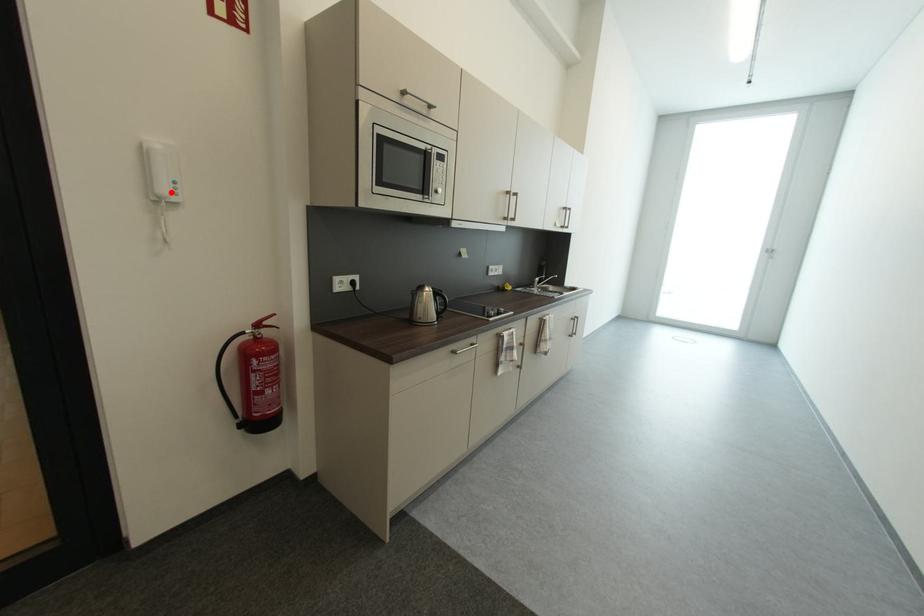
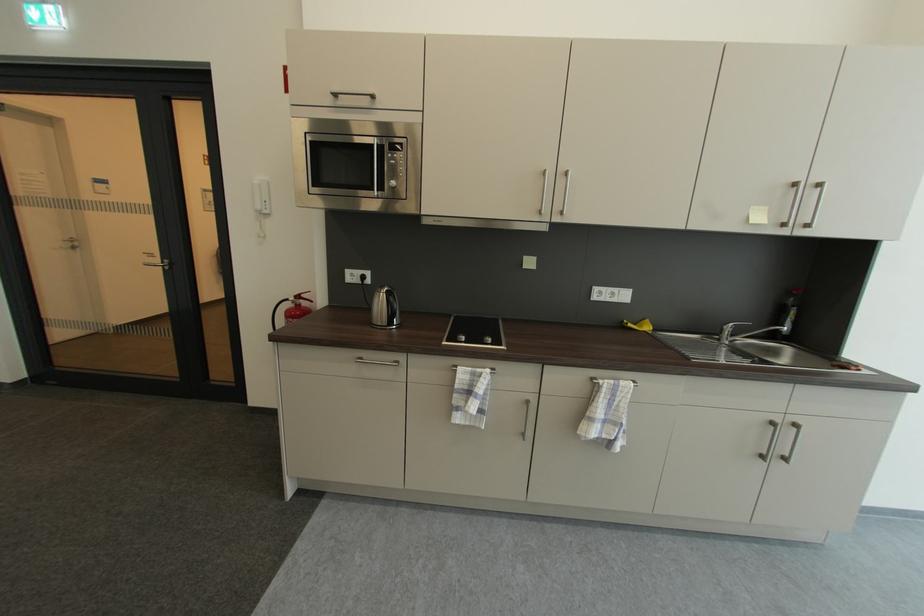
In the second image, find the point that corresponds to the highlighted location in the first image.

(264, 208)